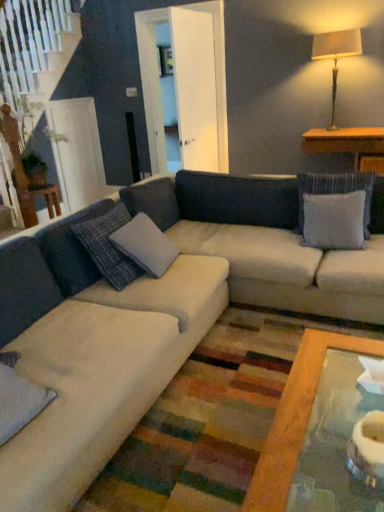
Question: From a real-world perspective, is matte beige lampshade at upper right located beneath velvety gray pillow at lower left, the third pillow positioned from the back?

Choices:
 (A) yes
 (B) no

Answer: (B)

Question: Is velvety gray pillow at lower left, which appears as the 1th pillow when viewed from the front, located within matte beige lampshade at upper right?

Choices:
 (A) no
 (B) yes

Answer: (A)

Question: Considering the relative sizes of matte beige lampshade at upper right and velvety gray pillow at lower left, the third pillow positioned from the back, in the image provided, is matte beige lampshade at upper right wider than velvety gray pillow at lower left, the third pillow positioned from the back,?

Choices:
 (A) yes
 (B) no

Answer: (B)

Question: Considering the relative positions of matte beige lampshade at upper right and velvety gray pillow at lower left, which appears as the 1th pillow when viewed from the front, in the image provided, is matte beige lampshade at upper right to the left of velvety gray pillow at lower left, which appears as the 1th pillow when viewed from the front, from the viewer's perspective?

Choices:
 (A) yes
 (B) no

Answer: (B)

Question: Is matte beige lampshade at upper right touching velvety gray pillow at lower left, the 3th pillow from the right?

Choices:
 (A) no
 (B) yes

Answer: (A)

Question: In the image, is velvety gray pillow at lower left, which appears as the 1th pillow when viewed from the front, positioned in front of or behind beige fabric couch at center?

Choices:
 (A) front
 (B) behind

Answer: (B)

Question: Considering the positions of point (x=24, y=380) and point (x=266, y=262), is point (x=24, y=380) closer or farther from the camera than point (x=266, y=262)?

Choices:
 (A) closer
 (B) farther

Answer: (A)

Question: From a real-world perspective, is velvety gray pillow at lower left, which appears as the 1th pillow when viewed from the front, positioned above or below beige fabric couch at center?

Choices:
 (A) above
 (B) below

Answer: (A)

Question: Is velvety gray pillow at lower left, the third pillow positioned from the back, wider or thinner than beige fabric couch at center?

Choices:
 (A) wide
 (B) thin

Answer: (B)

Question: Is gray fabric pillow at upper right, the third pillow viewed from the left, inside or outside of velvety gray pillow at lower left, which appears as the 1th pillow when viewed from the front?

Choices:
 (A) inside
 (B) outside

Answer: (B)

Question: Considering their positions, is gray fabric pillow at upper right, the third pillow viewed from the left, located in front of or behind velvety gray pillow at lower left, which appears as the 1th pillow when viewed from the front?

Choices:
 (A) front
 (B) behind

Answer: (B)

Question: Is gray fabric pillow at upper right, which ranks as the first pillow in right-to-left order, wider or thinner than velvety gray pillow at lower left, the 3th pillow from the right?

Choices:
 (A) thin
 (B) wide

Answer: (A)

Question: Looking at the image, does gray fabric pillow at upper right, the third pillow viewed from the left, seem bigger or smaller compared to velvety gray pillow at lower left, which appears as the 1th pillow when viewed from the front?

Choices:
 (A) big
 (B) small

Answer: (A)

Question: Considering the positions of wooden table at right and matte beige lampshade at upper right in the image, is wooden table at right wider or thinner than matte beige lampshade at upper right?

Choices:
 (A) thin
 (B) wide

Answer: (B)

Question: Based on their sizes in the image, would you say wooden table at right is bigger or smaller than matte beige lampshade at upper right?

Choices:
 (A) big
 (B) small

Answer: (A)